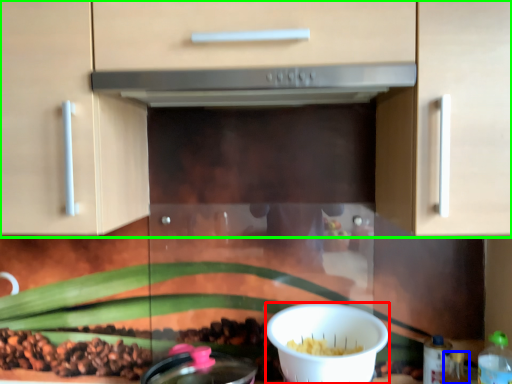
Question: Which is nearer to the bowl (highlighted by a red box)? bottle (highlighted by a blue box) or cabinetry (highlighted by a green box).

Choices:
 (A) bottle
 (B) cabinetry

Answer: (A)